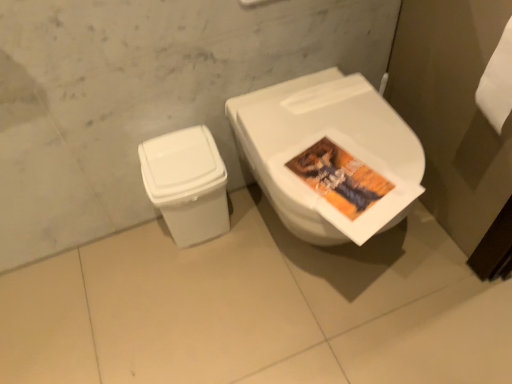
This screenshot has width=512, height=384. I want to click on free spot to the right of white plastic trash can at lower left, so click(257, 230).